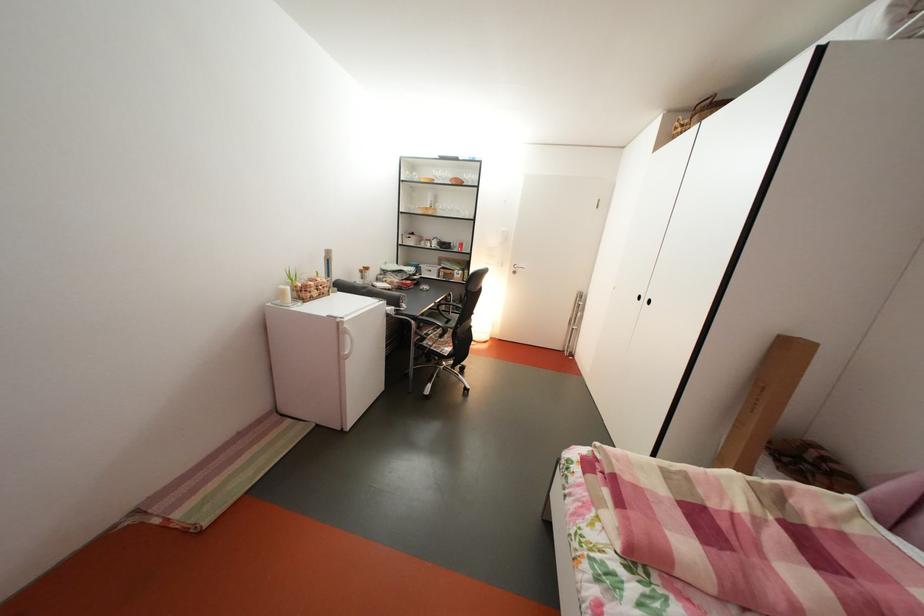
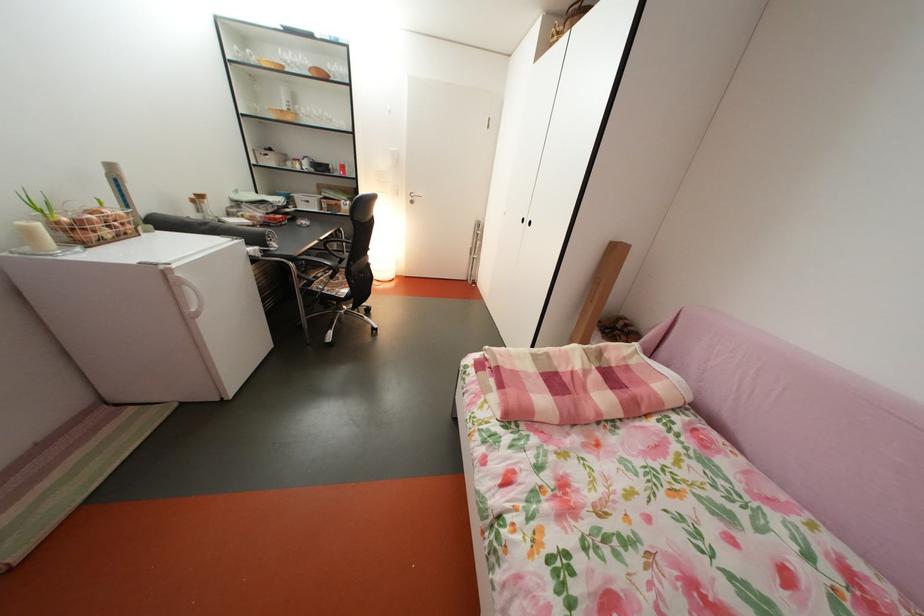
Where in the second image is the point corresponding to [349,326] from the first image?

(174, 274)